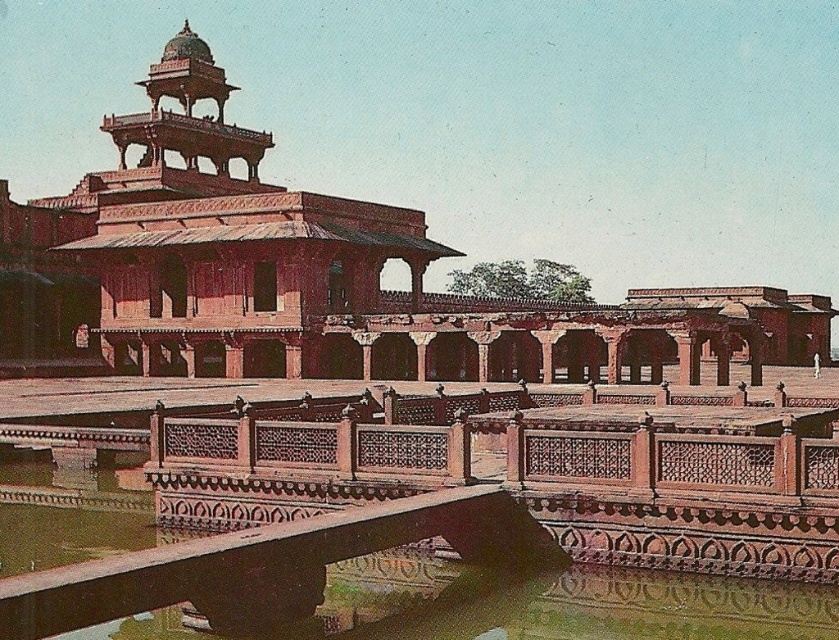
You are standing in front of a traditional Mughal palace made of red sandstone. There is a point marked at coordinates [306,275]. Based on the description, where is this point located?

The point is located on the matte red stone palace at center.

You are a drone operator tasked with capturing aerial footage of the matte red stone palace at center and the smooth stone water at center. The drone has a maximum flight range of 70 meters from its starting position. If you start at the palace, will you be able to film the water without exceeding the drone range?

The distance between the matte red stone palace at center and the smooth stone water at center is 71.22 meters. Since the drone can only fly up to 70 meters from its starting position, it will not be able to reach the water without exceeding its range.